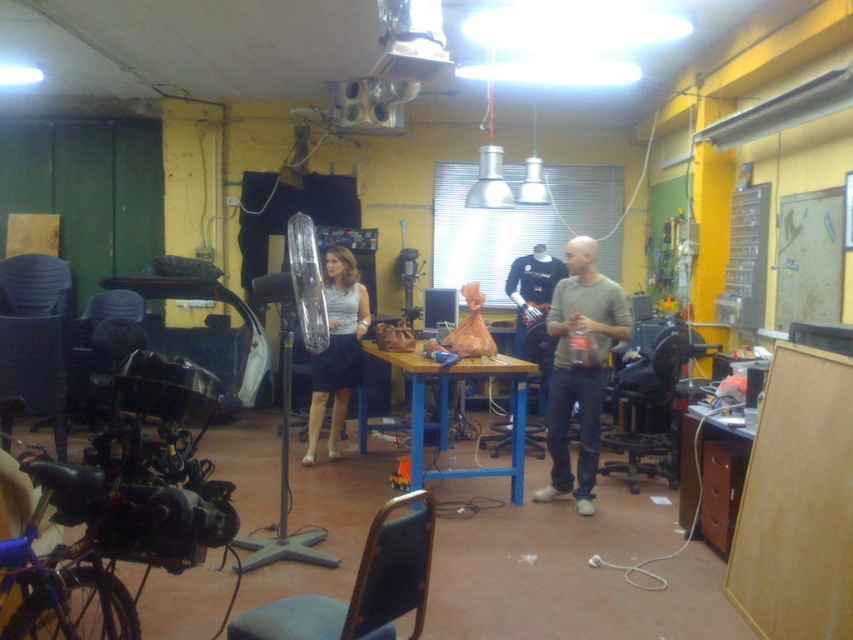
Does wooden table at center lie behind wooden desk at lower right?

Yes, wooden table at center is behind wooden desk at lower right.

Does wooden table at center appear under wooden desk at lower right?

Incorrect, wooden table at center is not positioned below wooden desk at lower right.

Image resolution: width=853 pixels, height=640 pixels. What do you see at coordinates (448, 412) in the screenshot? I see `wooden table at center` at bounding box center [448, 412].

Find the location of a particular element. wooden table at center is located at coordinates (448, 412).

Does matte gray skirt at center have a larger size compared to wooden desk at lower right?

Indeed, matte gray skirt at center has a larger size compared to wooden desk at lower right.

Does point (337, 360) lie in front of point (730, 486)?

No, (337, 360) is behind (730, 486).

Find the location of a particular element. The width and height of the screenshot is (853, 640). matte gray skirt at center is located at coordinates (337, 348).

Does gray cotton shirt at center lie in front of wooden table at center?

Yes.

Based on the photo, can you confirm if gray cotton shirt at center is thinner than wooden table at center?

Indeed, gray cotton shirt at center has a lesser width compared to wooden table at center.

This screenshot has height=640, width=853. What do you see at coordinates (579, 368) in the screenshot?
I see `gray cotton shirt at center` at bounding box center [579, 368].

You are a GUI agent. You are given a task and a screenshot of the screen. Output one action in this format:
    pyautogui.click(x=<x>, y=<y>)
    Task: Click on the gray cotton shirt at center
    This screenshot has width=853, height=640.
    Given the screenshot: What is the action you would take?
    pyautogui.click(x=579, y=368)